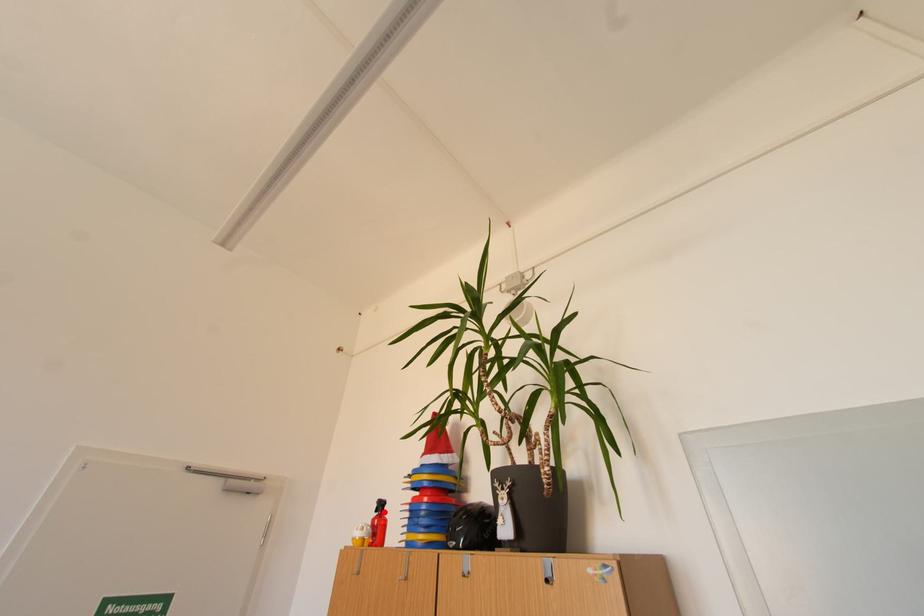
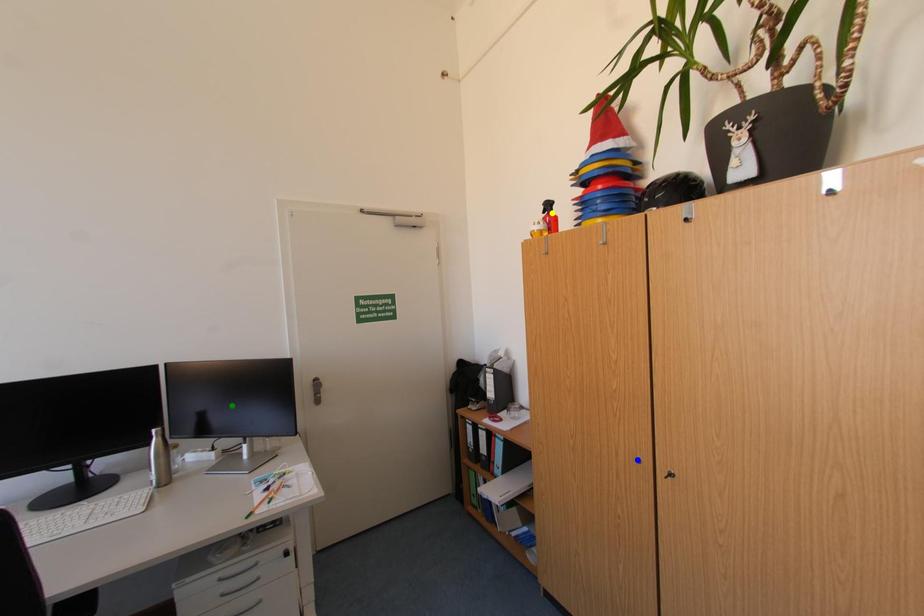
Question: I am providing you with two images of the same scene from different viewpoints. A red point is marked on the first image. You are given multiple points on the second image. In image 2, which mark is for the same physical point as the one in image 1?

Choices:
 (A) green point
 (B) yellow point
 (C) blue point

Answer: (B)